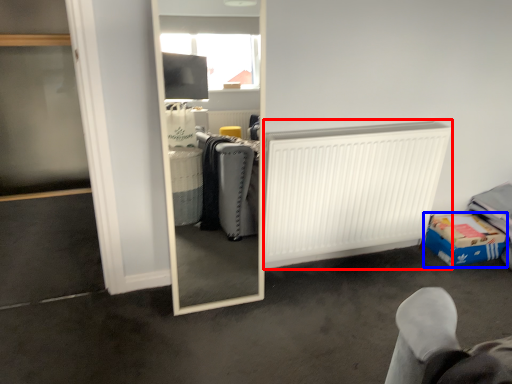
Question: Which object appears closest to the camera in this image, radiator (highlighted by a red box) or cardboard box (highlighted by a blue box)?

Choices:
 (A) radiator
 (B) cardboard box

Answer: (A)